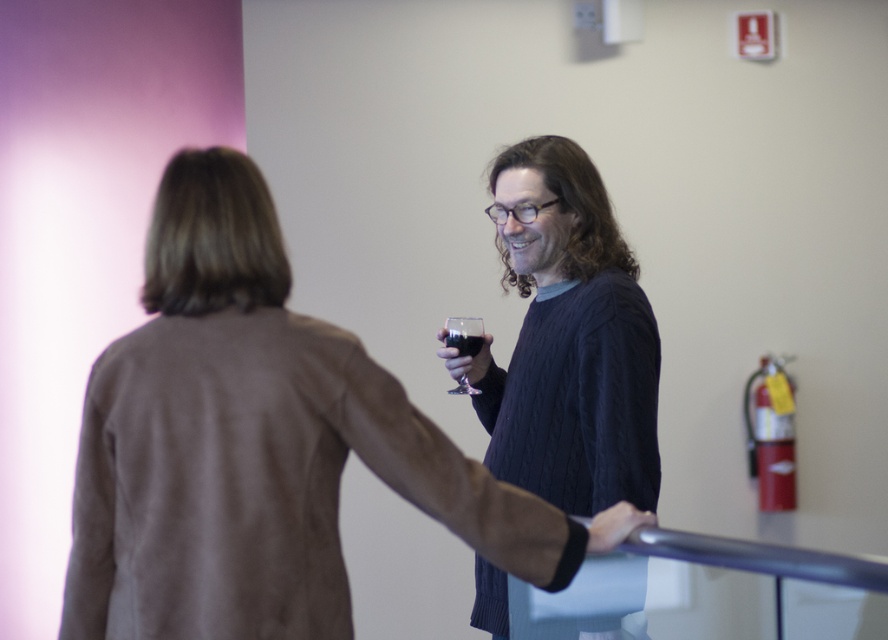
Question: Which object appears closest to the camera in this image?

Choices:
 (A) transparent glass at right
 (B) knitted sweater at center
 (C) brown suede jacket at center

Answer: (C)

Question: Which object is positioned closest to the transparent glass at right?

Choices:
 (A) brown suede jacket at center
 (B) knitted sweater at center
 (C) translucent glass at center

Answer: (C)

Question: Can you confirm if transparent glass at right is smaller than translucent glass at center?

Choices:
 (A) yes
 (B) no

Answer: (B)

Question: Which point appears closest to the camera in this image?

Choices:
 (A) click(x=461, y=323)
 (B) click(x=113, y=476)
 (C) click(x=551, y=497)

Answer: (B)

Question: Does brown suede jacket at center appear under knitted sweater at center?

Choices:
 (A) yes
 (B) no

Answer: (A)

Question: From the image, what is the correct spatial relationship of brown suede jacket at center in relation to knitted sweater at center?

Choices:
 (A) right
 (B) left

Answer: (B)